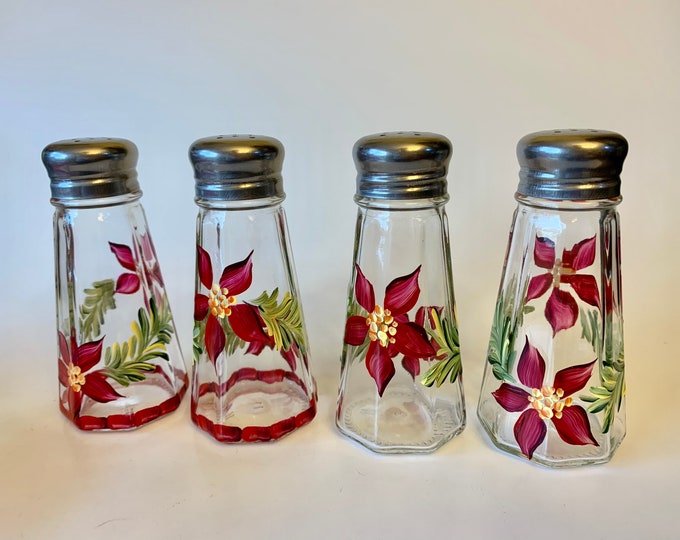
Find the location of a particular element. salt shaker 2 is located at coordinates (239, 318).